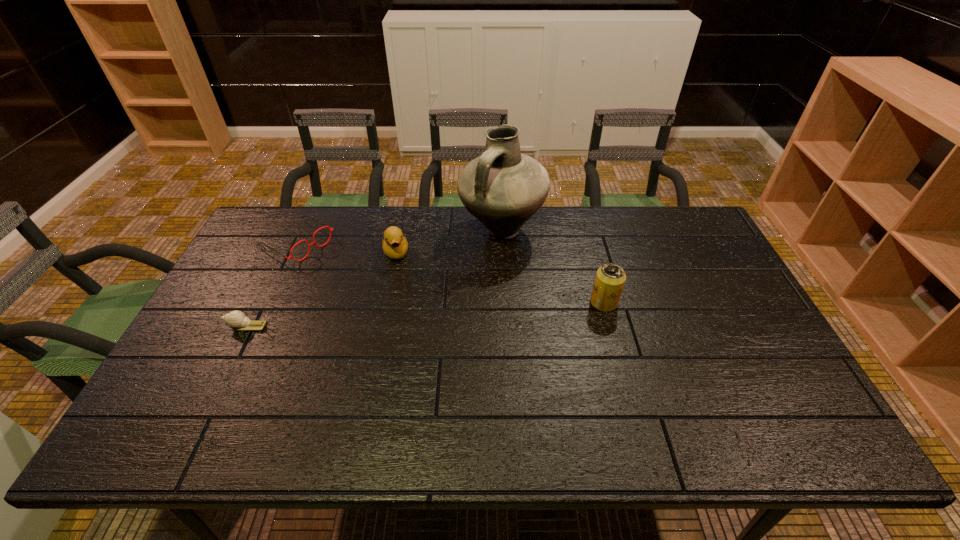
I want to click on free region at the far left corner of the desktop, so click(265, 243).

Where is `vacant area at the near left corner of the desktop`? Image resolution: width=960 pixels, height=540 pixels. vacant area at the near left corner of the desktop is located at coordinates (x=168, y=404).

The image size is (960, 540). I want to click on free space between the pitcher and the duckling, so click(x=448, y=241).

Where is `vacant point located between the second nearest object and the third object from right to left`? The height and width of the screenshot is (540, 960). vacant point located between the second nearest object and the third object from right to left is located at coordinates (500, 278).

Locate an element on the screen. free space that is in between the fourth tallest object and the third shortest object is located at coordinates (347, 248).

At what (x,y) coordinates should I click in order to perform the action: click on free space between the beer can and the escargot. Please return your answer as a coordinate pair (x, y). This screenshot has height=540, width=960. Looking at the image, I should click on tap(425, 314).

You are a GUI agent. You are given a task and a screenshot of the screen. Output one action in this format:
    pyautogui.click(x=<x>, y=<y>)
    Task: Click on the blank region between the second object from right to left and the beer can
    Image resolution: width=960 pixels, height=540 pixels.
    Given the screenshot: What is the action you would take?
    point(553,266)

The image size is (960, 540). In order to click on free space that is in between the rightmost object and the tallest object in this screenshot , I will do `click(553, 266)`.

I want to click on unoccupied position between the third object from right to left and the beer can, so click(x=500, y=278).

Where is `vacant space that is in between the tallest object and the third object from right to left`? This screenshot has width=960, height=540. vacant space that is in between the tallest object and the third object from right to left is located at coordinates (448, 241).